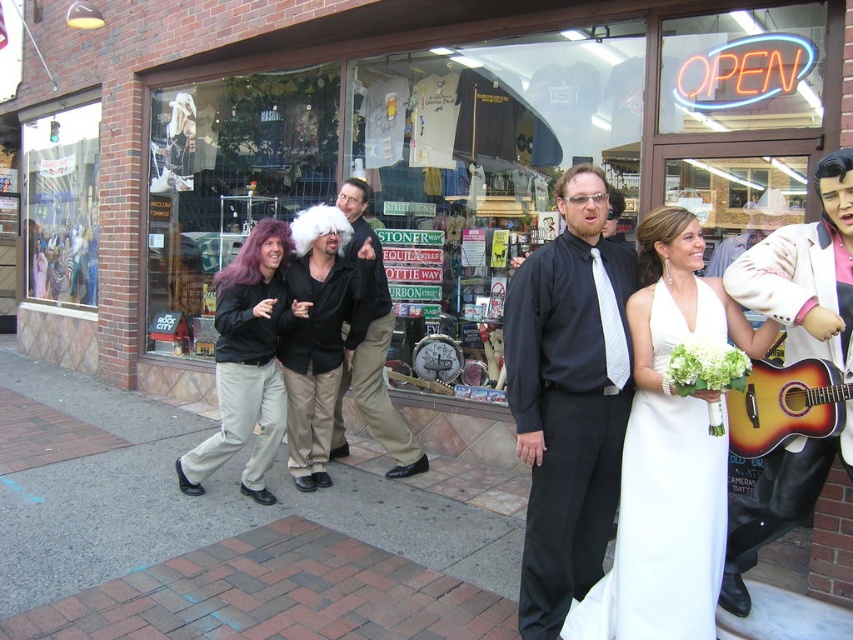
Question: Estimate the real-world distances between objects in this image. Which object is closer to the matte black wig at center?

Choices:
 (A) khaki pants at center
 (B) white satin dress at center
 (C) white leather jacket at right
 (D) black matte wig at center

Answer: (D)

Question: From the image, what is the correct spatial relationship of matte black shirt at center in relation to black matte wig at center?

Choices:
 (A) left
 (B) right

Answer: (B)

Question: Is white leather jacket at right closer to the viewer compared to purple hair at left?

Choices:
 (A) no
 (B) yes

Answer: (B)

Question: Is matte black shirt at center bigger than sunburst wood guitar at center?

Choices:
 (A) no
 (B) yes

Answer: (B)

Question: Which of the following is the farthest from the observer?

Choices:
 (A) (351, 346)
 (B) (682, 323)
 (C) (749, 449)
 (D) (730, 282)

Answer: (A)

Question: Estimate the real-world distances between objects in this image. Which object is farther from the black matte wig at center?

Choices:
 (A) white satin dress at center
 (B) white leather jacket at right
 (C) brick pavement at center

Answer: (B)